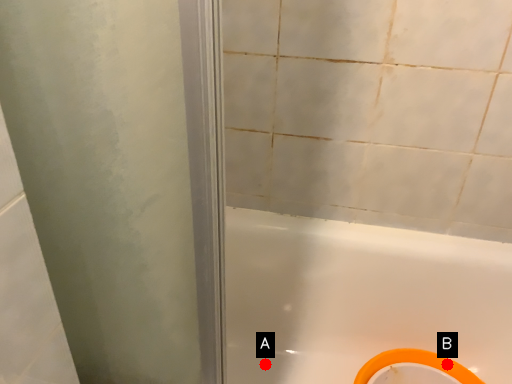
Question: Two points are circled on the image, labeled by A and B beside each circle. Which point is farther from the camera taking this photo?

Choices:
 (A) A is further
 (B) B is further

Answer: (A)